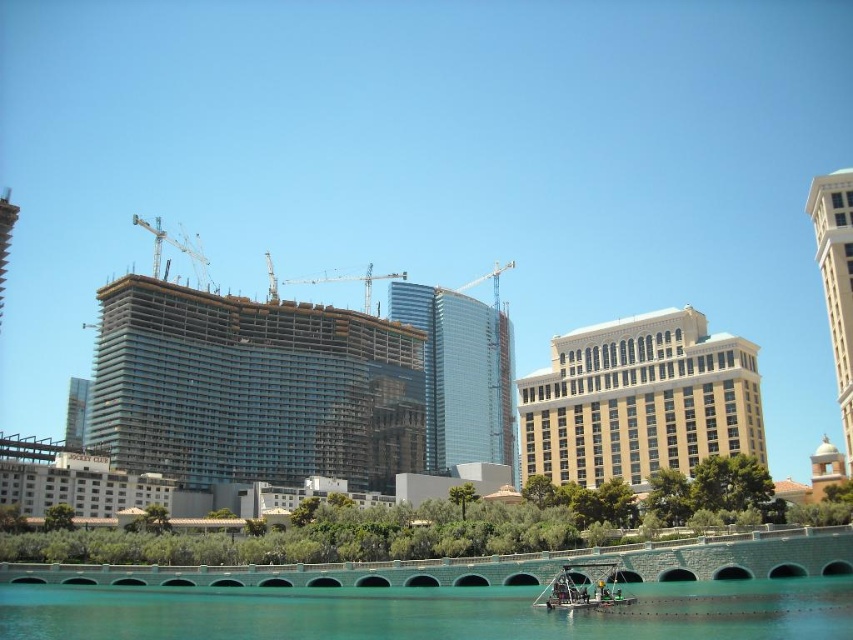
You are an architect reviewing this urban design. You need to determine which object occupies more visual space in the image. Based on the scene description, which one is bigger between the beige marble tower at upper right and the metallic construction crane at center?

The beige marble tower at upper right is larger in size than the metallic construction crane at center, so it occupies more visual space in the image.

What is the color and material of the building located at the coordinates point (639, 401)?

The point (639, 401) corresponds to a beige stone building at center.